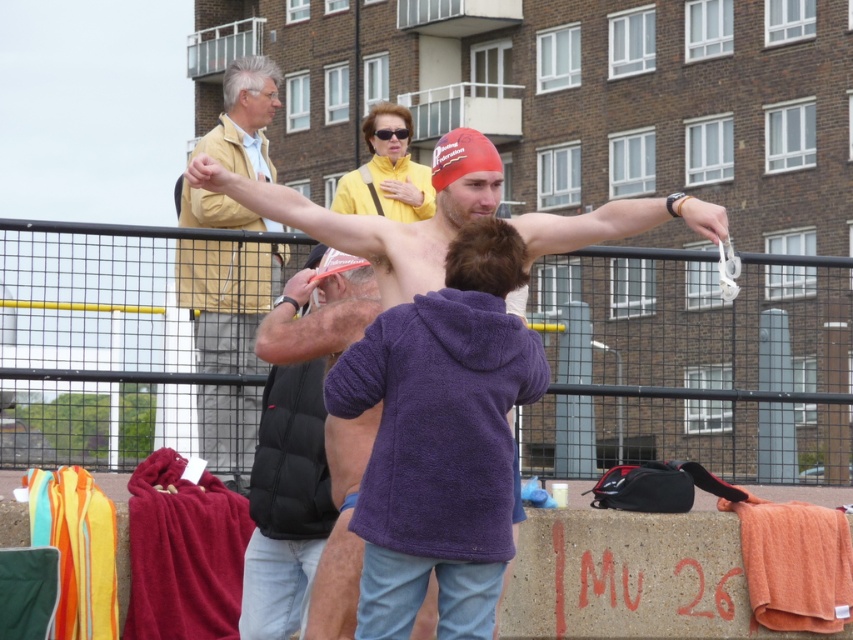
Question: Which object appears farthest from the camera in this image?

Choices:
 (A) shiny red swim cap at center
 (B) black puffer vest at center

Answer: (B)

Question: Which point is closer to the camera?

Choices:
 (A) pyautogui.click(x=225, y=284)
 (B) pyautogui.click(x=111, y=381)

Answer: (B)

Question: Considering the relative positions of black mesh fence at lower center and black puffer vest at center in the image provided, where is black mesh fence at lower center located with respect to black puffer vest at center?

Choices:
 (A) left
 (B) right

Answer: (A)

Question: Which object is farther from the camera taking this photo?

Choices:
 (A) black puffer vest at center
 (B) black mesh fence at lower center

Answer: (B)

Question: Observing the image, what is the correct spatial positioning of shiny red swim cap at center in reference to light yellow jacket at upper left?

Choices:
 (A) below
 (B) above

Answer: (A)

Question: Can you confirm if black mesh fence at lower center is positioned below light yellow jacket at upper left?

Choices:
 (A) no
 (B) yes

Answer: (B)